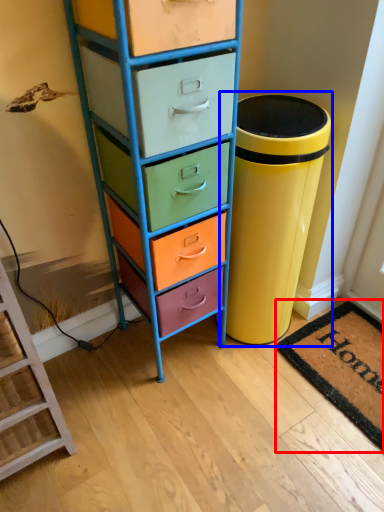
Question: Which object is closer to the camera taking this photo, mat (highlighted by a red box) or waste container (highlighted by a blue box)?

Choices:
 (A) mat
 (B) waste container

Answer: (B)